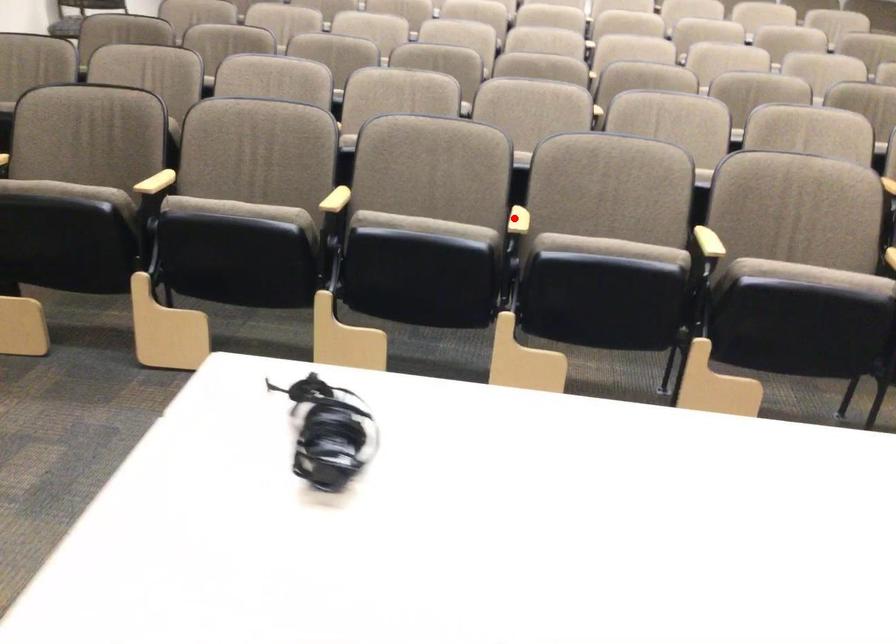
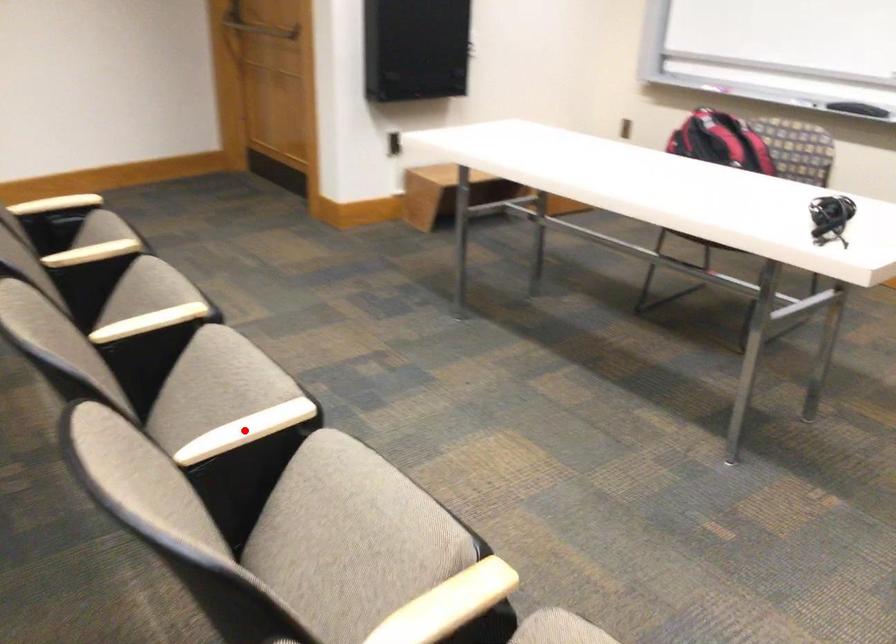
Looking at this image, I am providing you with two images of the same scene from different viewpoints. A red point is marked on the first image and another point is marked on the second image. Is the marked point in image1 the same physical position as the marked point in image2?

Yes